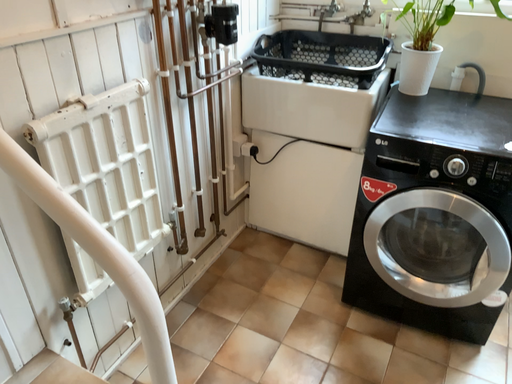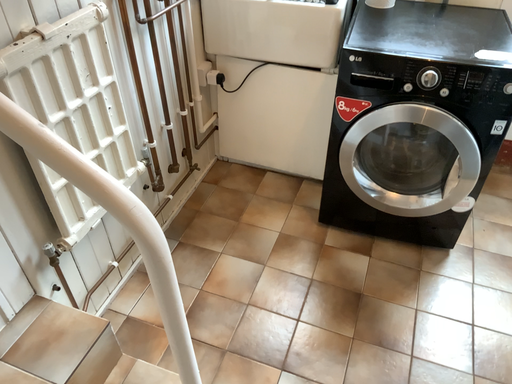
Question: How did the camera likely rotate when shooting the video?

Choices:
 (A) rotated upward
 (B) rotated downward

Answer: (B)